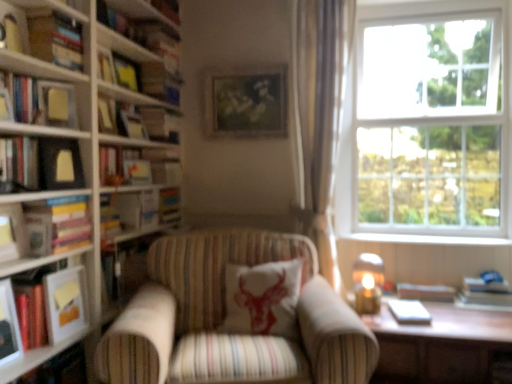
Question: Is clear glass window at upper right further to the viewer compared to hardcover book at left, which is counted as the 1th book, starting from the bottom?

Choices:
 (A) yes
 (B) no

Answer: (A)

Question: Is clear glass window at upper right smaller than hardcover book at left, which is counted as the 1th book, starting from the bottom?

Choices:
 (A) no
 (B) yes

Answer: (A)

Question: From a real-world perspective, is clear glass window at upper right physically above hardcover book at left, the seventh book positioned from the top?

Choices:
 (A) yes
 (B) no

Answer: (A)

Question: Considering the relative sizes of clear glass window at upper right and hardcover book at left, the seventh book positioned from the top, in the image provided, is clear glass window at upper right bigger than hardcover book at left, the seventh book positioned from the top,?

Choices:
 (A) yes
 (B) no

Answer: (A)

Question: Could you tell me if clear glass window at upper right is turned towards hardcover book at left, which is counted as the 1th book, starting from the bottom?

Choices:
 (A) yes
 (B) no

Answer: (B)

Question: Can you confirm if clear glass window at upper right is positioned to the left of hardcover book at left, which is counted as the 1th book, starting from the bottom?

Choices:
 (A) yes
 (B) no

Answer: (B)

Question: Can you confirm if matte glass candle at right is wider than hardcover book at left, marked as the 3th book in a top-to-bottom arrangement?

Choices:
 (A) yes
 (B) no

Answer: (B)

Question: Considering the relative positions of matte glass candle at right and hardcover book at left, marked as the 3th book in a top-to-bottom arrangement, in the image provided, is matte glass candle at right to the left of hardcover book at left, marked as the 3th book in a top-to-bottom arrangement, from the viewer's perspective?

Choices:
 (A) yes
 (B) no

Answer: (B)

Question: From a real-world perspective, is matte glass candle at right over hardcover book at left, marked as the 3th book in a top-to-bottom arrangement?

Choices:
 (A) yes
 (B) no

Answer: (B)

Question: Does matte glass candle at right turn towards hardcover book at left, marked as the 5th book in a bottom-to-top arrangement?

Choices:
 (A) yes
 (B) no

Answer: (B)

Question: Does matte glass candle at right have a lesser width compared to hardcover book at left, marked as the 5th book in a bottom-to-top arrangement?

Choices:
 (A) no
 (B) yes

Answer: (B)

Question: Is matte glass candle at right further to camera compared to hardcover book at left, marked as the 3th book in a top-to-bottom arrangement?

Choices:
 (A) yes
 (B) no

Answer: (A)

Question: Is matte black picture frame at left, the 4th picture frame positioned from the back, oriented away from hardcover book at left, which appears as the 3th book when ordered from the bottom?

Choices:
 (A) yes
 (B) no

Answer: (B)